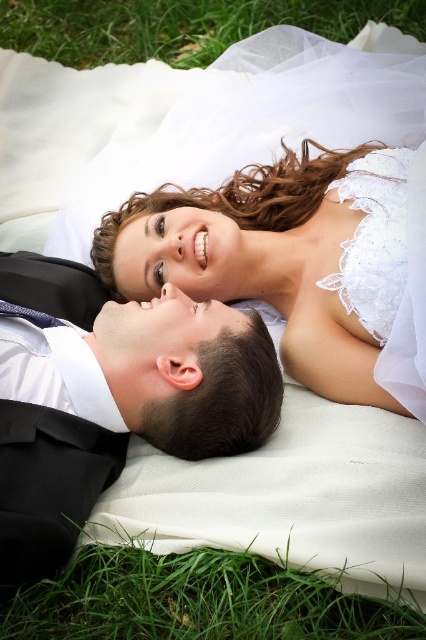
Does black satin suit at upper left have a larger size compared to green grass at upper left?

Indeed, black satin suit at upper left has a larger size compared to green grass at upper left.

Between black satin suit at upper left and green grass at upper left, which one appears on the left side from the viewer's perspective?

Positioned to the left is black satin suit at upper left.

Does point (62, 360) lie in front of point (0, 42)?

Yes.

Locate an element on the screen. black satin suit at upper left is located at coordinates (111, 397).

In the scene shown: Who is lower down, white lace dress at upper center or green grass at upper left?

Positioned lower is white lace dress at upper center.

Does white lace dress at upper center appear under green grass at upper left?

Indeed, white lace dress at upper center is positioned under green grass at upper left.

Is point (232, 273) closer to viewer compared to point (14, 13)?

Yes, it is.

Find the location of a particular element. The height and width of the screenshot is (640, 426). white lace dress at upper center is located at coordinates (299, 262).

In the scene shown: Which is more to the right, green grass at upper left or lace white dress at upper center?

From the viewer's perspective, lace white dress at upper center appears more on the right side.

Does green grass at upper left have a lesser height compared to lace white dress at upper center?

Yes.

The image size is (426, 640). Find the location of `green grass at upper left`. green grass at upper left is located at coordinates (181, 26).